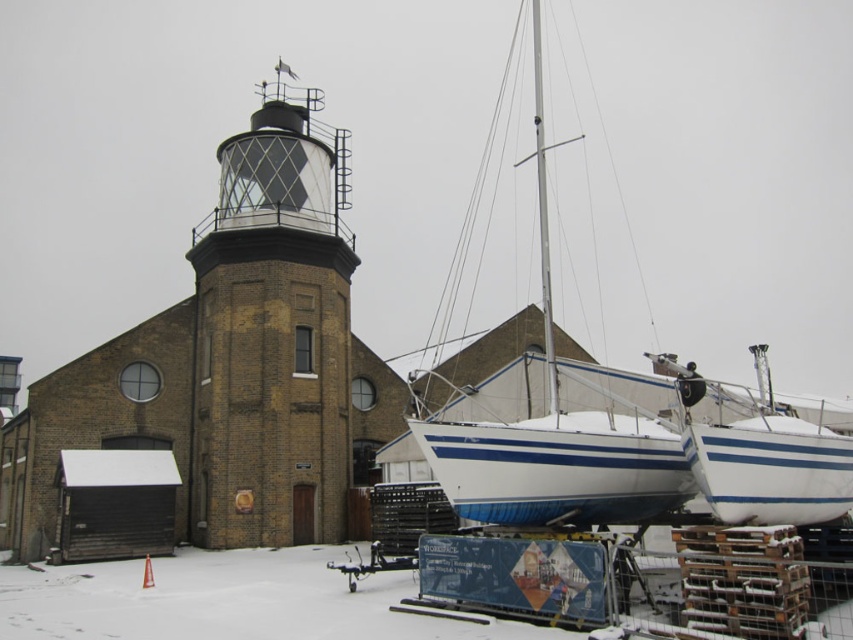
Question: From the image, what is the correct spatial relationship of matte black lighthouse at center in relation to white glossy sailboat at center?

Choices:
 (A) below
 (B) above

Answer: (A)

Question: Which point is closer to the camera taking this photo?

Choices:
 (A) click(311, 106)
 (B) click(515, 429)

Answer: (B)

Question: Which of the following is the closest to the observer?

Choices:
 (A) matte black lighthouse at center
 (B) white glossy sailboat at center
 (C) white glossy mast at center

Answer: (B)

Question: Does white glossy sailboat at center have a greater width compared to white glossy mast at center?

Choices:
 (A) yes
 (B) no

Answer: (A)

Question: Which point appears closest to the camera in this image?

Choices:
 (A) (547, 524)
 (B) (553, 392)

Answer: (A)

Question: Does matte black lighthouse at center have a larger size compared to white glossy sailboat at center?

Choices:
 (A) yes
 (B) no

Answer: (B)